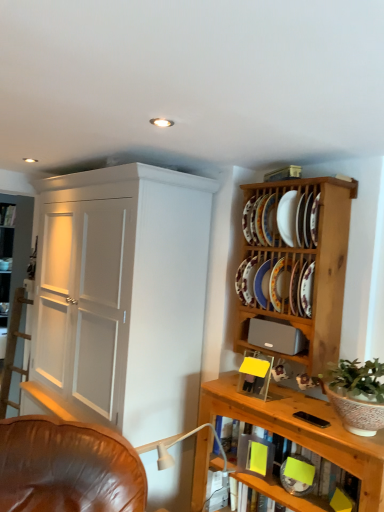
Question: Does green leafy plant in textured ceramic pot at right appear on the left side of porcelain plate at upper right, which ranks as the fifth platter in top-to-bottom order?

Choices:
 (A) no
 (B) yes

Answer: (A)

Question: Is green leafy plant in textured ceramic pot at right next to porcelain plate at upper right, which ranks as the fifth platter in top-to-bottom order?

Choices:
 (A) yes
 (B) no

Answer: (B)

Question: Is porcelain plate at upper right, which ranks as the fifth platter in top-to-bottom order, at the back of green leafy plant in textured ceramic pot at right?

Choices:
 (A) yes
 (B) no

Answer: (B)

Question: Is green leafy plant in textured ceramic pot at right aimed at porcelain plate at upper right, acting as the 1th platter starting from the bottom?

Choices:
 (A) yes
 (B) no

Answer: (B)

Question: Would you say green leafy plant in textured ceramic pot at right is a long distance from porcelain plate at upper right, acting as the 1th platter starting from the bottom?

Choices:
 (A) no
 (B) yes

Answer: (A)

Question: Considering the positions of point (243, 312) and point (244, 260), is point (243, 312) closer or farther from the camera than point (244, 260)?

Choices:
 (A) farther
 (B) closer

Answer: (A)

Question: Considering the positions of gray matte speaker at upper right and matte ceramic platter at upper right, the third platter when ordered from bottom to top, in the image, is gray matte speaker at upper right wider or thinner than matte ceramic platter at upper right, the third platter when ordered from bottom to top,?

Choices:
 (A) thin
 (B) wide

Answer: (A)

Question: Is gray matte speaker at upper right taller or shorter than matte ceramic platter at upper right, positioned as the 3th platter in top-to-bottom order?

Choices:
 (A) short
 (B) tall

Answer: (A)

Question: Is gray matte speaker at upper right to the left or to the right of matte ceramic platter at upper right, the third platter when ordered from bottom to top, in the image?

Choices:
 (A) right
 (B) left

Answer: (B)

Question: In terms of width, does matte ceramic platter at upper right, positioned as the 3th platter in top-to-bottom order, look wider or thinner when compared to porcelain plate at upper right, acting as the 1th platter starting from the bottom?

Choices:
 (A) thin
 (B) wide

Answer: (B)

Question: Choose the correct answer: Is matte ceramic platter at upper right, positioned as the 3th platter in top-to-bottom order, inside porcelain plate at upper right, acting as the 1th platter starting from the bottom, or outside it?

Choices:
 (A) inside
 (B) outside

Answer: (B)

Question: Visually, is matte ceramic platter at upper right, positioned as the 3th platter in top-to-bottom order, positioned to the left or to the right of porcelain plate at upper right, which ranks as the fifth platter in top-to-bottom order?

Choices:
 (A) left
 (B) right

Answer: (A)

Question: In terms of size, does matte ceramic platter at upper right, positioned as the 3th platter in top-to-bottom order, appear bigger or smaller than porcelain plate at upper right, acting as the 1th platter starting from the bottom?

Choices:
 (A) small
 (B) big

Answer: (B)

Question: Considering the positions of point (304, 269) and point (281, 217), is point (304, 269) closer or farther from the camera than point (281, 217)?

Choices:
 (A) farther
 (B) closer

Answer: (B)

Question: From the image's perspective, relative to white ceramic plate at upper right, is porcelain plate at upper right, which ranks as the fifth platter in top-to-bottom order, above or below?

Choices:
 (A) below
 (B) above

Answer: (A)